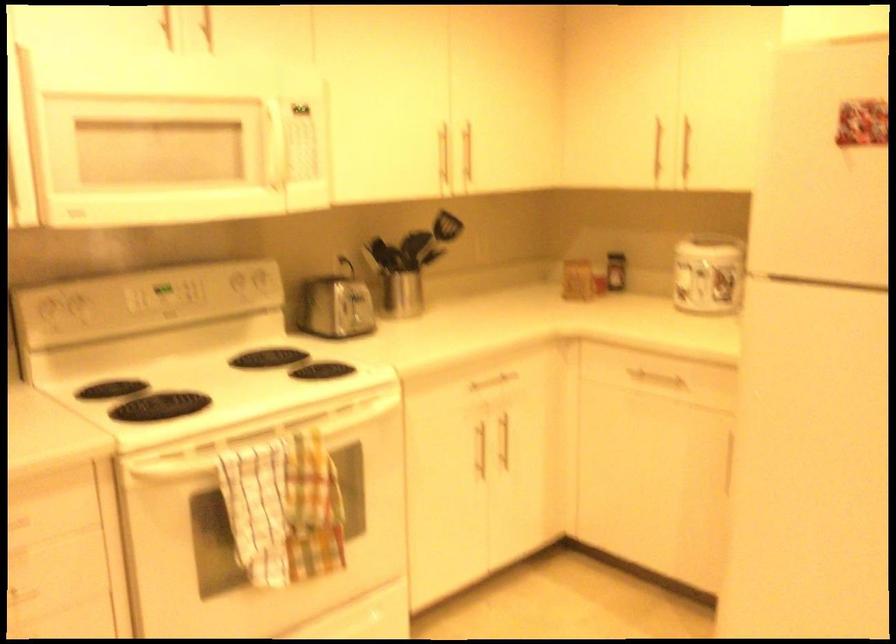
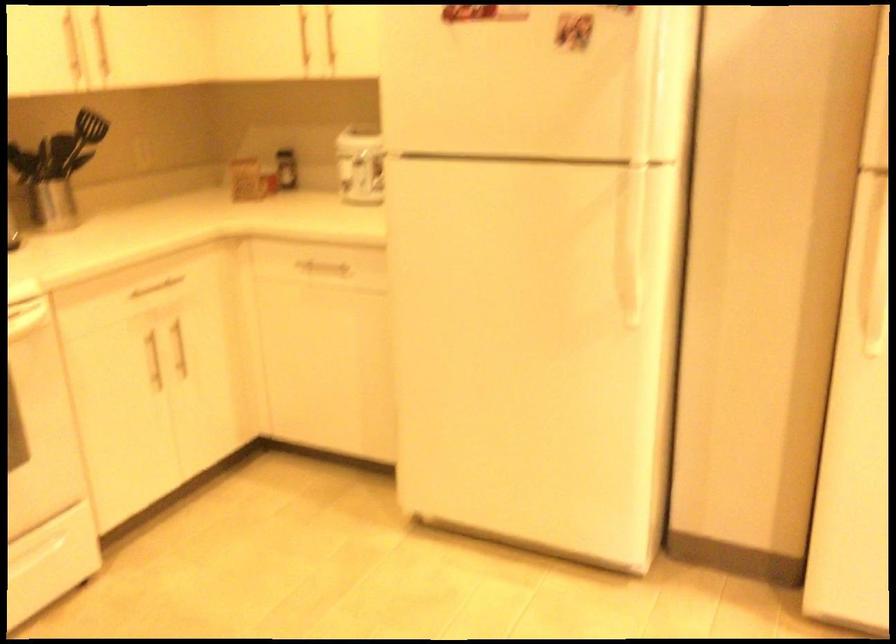
In the second image, find the point that corresponds to point 496,375 in the first image.

(159, 283)